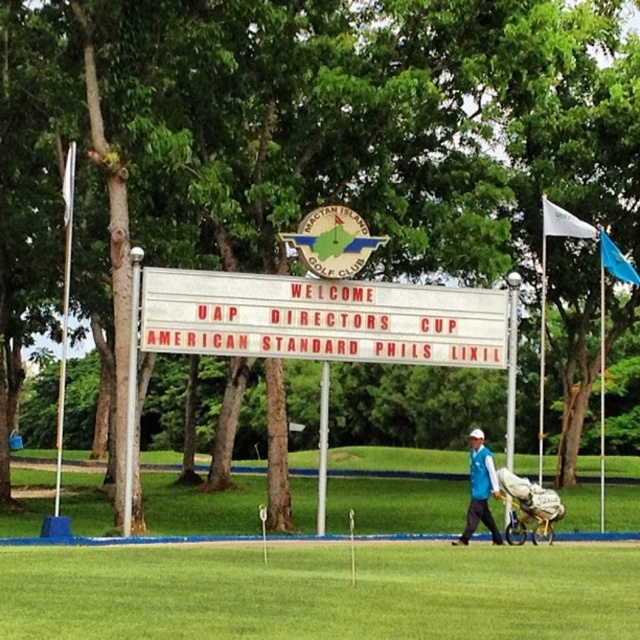
Between metallic silver baby carriage at center and white fabric flag at upper right, which one is positioned lower?

metallic silver baby carriage at center is lower down.

Which is more to the right, metallic silver baby carriage at center or white fabric flag at upper right?

Positioned to the right is white fabric flag at upper right.

Where is `metallic silver baby carriage at center`? This screenshot has height=640, width=640. metallic silver baby carriage at center is located at coordinates (529, 508).

Between metallic silver baby carriage at center and blue fabric golfer at center, which one appears on the left side from the viewer's perspective?

From the viewer's perspective, blue fabric golfer at center appears more on the left side.

Measure the distance between point (522, 532) and camera.

79.91 feet

Locate an element on the screen. Image resolution: width=640 pixels, height=640 pixels. metallic silver baby carriage at center is located at coordinates (529, 508).

Can you confirm if blue fabric golfer at center is positioned above blue fabric flag at upper right?

No, blue fabric golfer at center is not above blue fabric flag at upper right.

Does blue fabric golfer at center appear on the right side of blue fabric flag at upper right?

In fact, blue fabric golfer at center is to the left of blue fabric flag at upper right.

Does point (488, 468) come closer to viewer compared to point (602, 228)?

Yes.

Identify the location of blue fabric golfer at center. The image size is (640, 640). (480, 490).